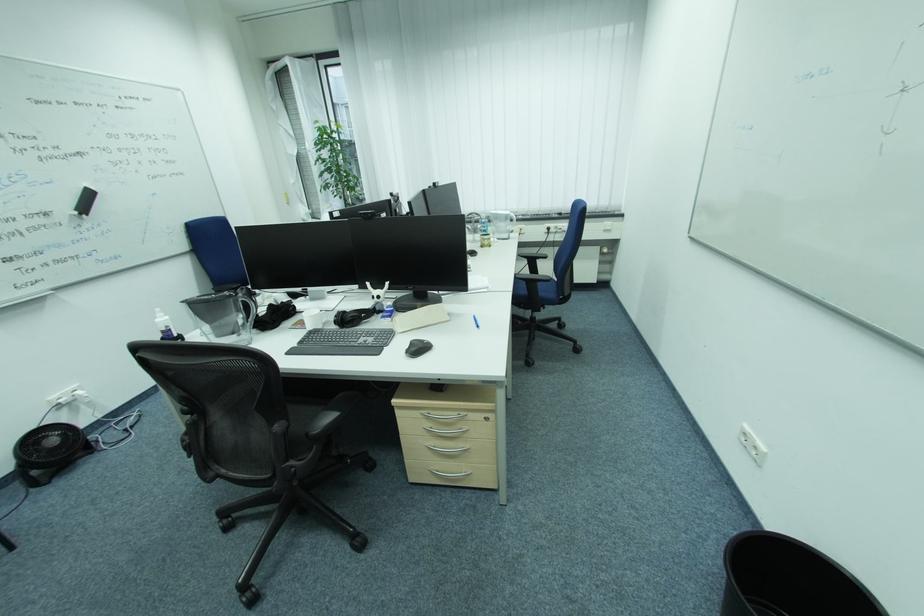
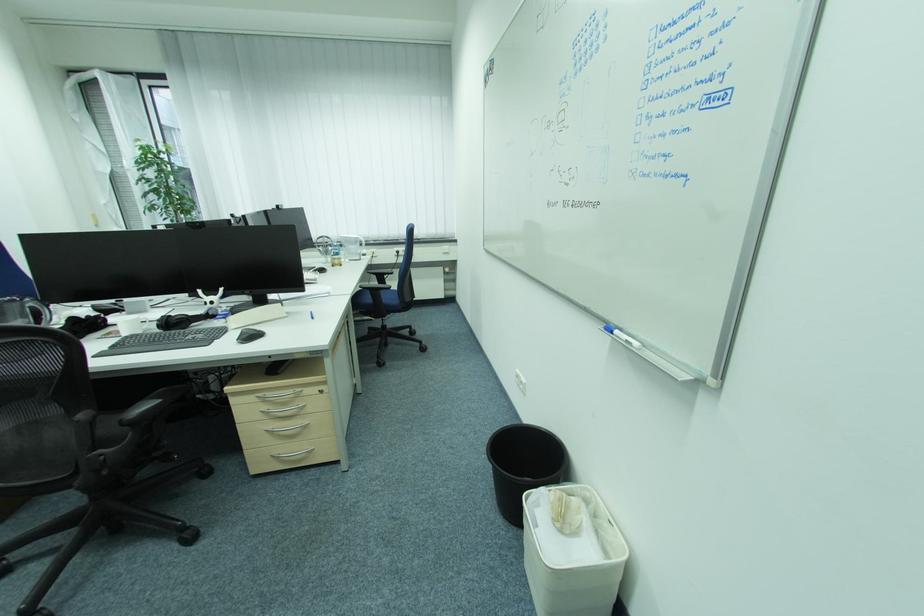
In a continuous first-person perspective shot, in which direction is the camera moving?

The movement direction of the cameraman is right, backward.